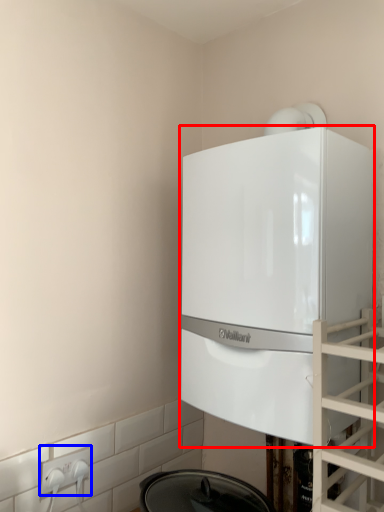
Question: Among these objects, which one is farthest to the camera, home appliance (highlighted by a red box) or electric outlet (highlighted by a blue box)?

Choices:
 (A) home appliance
 (B) electric outlet

Answer: (B)